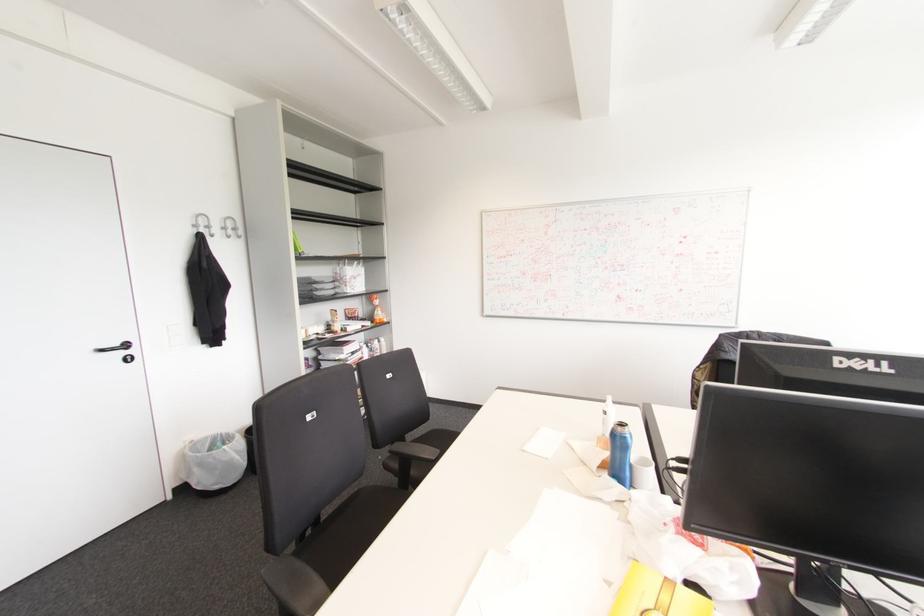
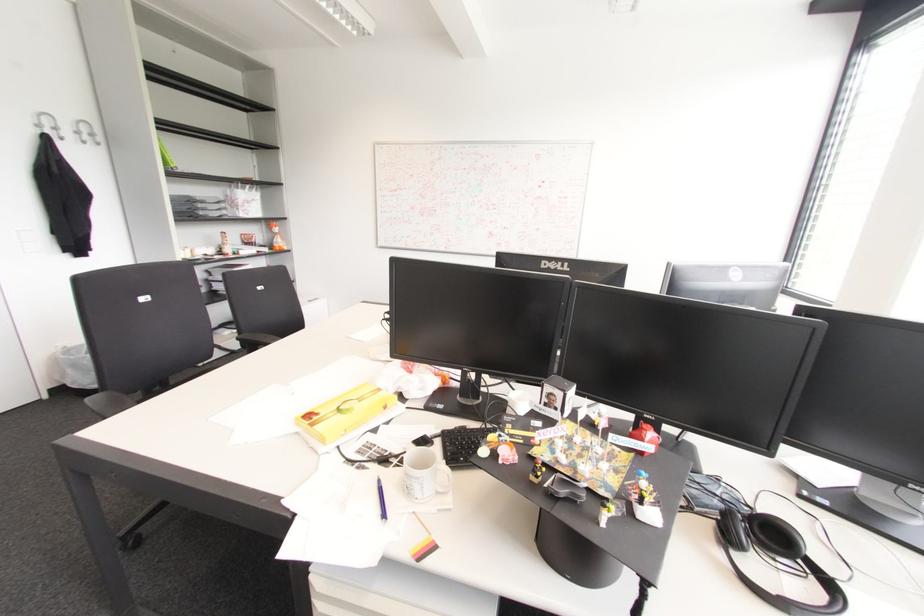
The images are taken continuously from a first-person perspective. In which direction are you moving?

The cameraman moved toward right, backward.